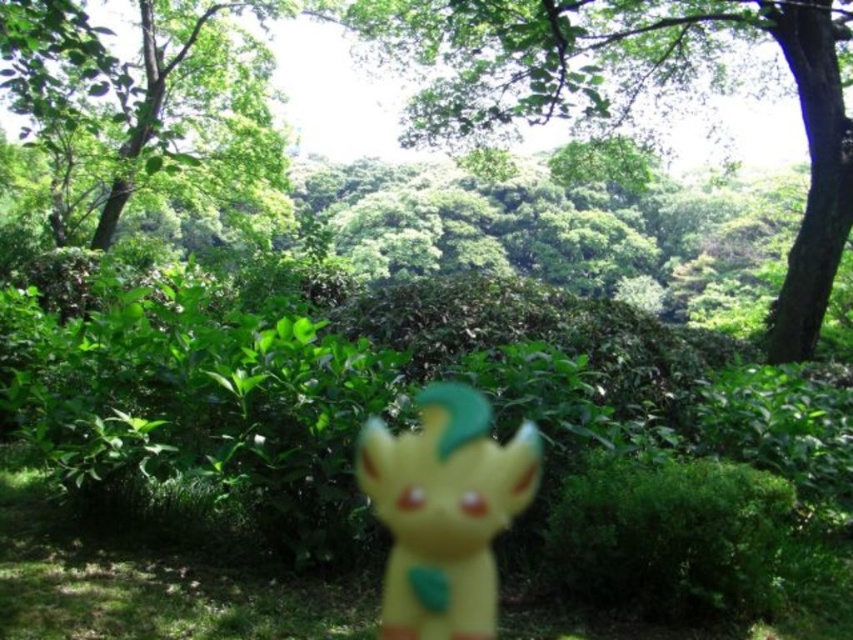
You are standing in the forest scene described. There is a point marked at coordinates (x=631, y=92). What object is located at that point?

The green leafy tree at upper center is located at point (x=631, y=92).

You are a photographer standing at the camera position. You want to take a closeup photo of the yellow matte grass at center. Can you step forward to get closer without moving the grass?

The yellow matte grass at center and camera are 1.34 meters apart. Since you can move forward, stepping closer would allow you to take the closeup photo.